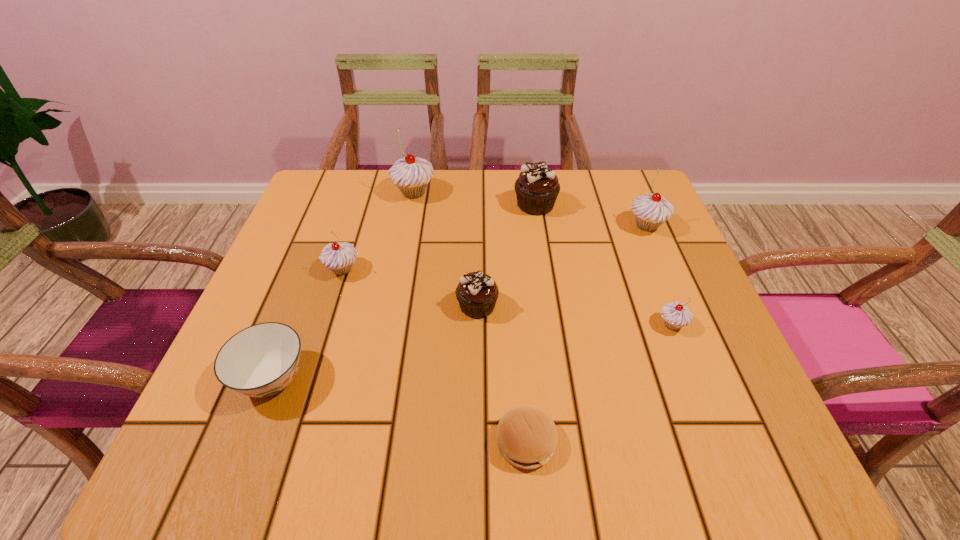
Find the location of a particular element. free spot at the near left corner of the desktop is located at coordinates (179, 458).

This screenshot has height=540, width=960. In the image, there is a desktop. What are the coordinates of `vacant area at the far right corner` in the screenshot? It's located at (614, 177).

I want to click on vacant space at the near right corner, so click(x=740, y=454).

The width and height of the screenshot is (960, 540). I want to click on free space between the farthest gray cupcake and the nearest gray cupcake, so click(x=542, y=259).

The width and height of the screenshot is (960, 540). What are the coordinates of `free area in between the nearest gray cupcake and the second gray cupcake from left to right` in the screenshot? It's located at (542, 259).

This screenshot has width=960, height=540. What are the coordinates of `unoccupied area between the nearest gray cupcake and the seventh tallest object` in the screenshot? It's located at (472, 352).

The height and width of the screenshot is (540, 960). In order to click on free spot between the nearest gray cupcake and the farther brown cupcake in this screenshot , I will do `click(604, 265)`.

This screenshot has height=540, width=960. In order to click on vacant space in between the leftmost cupcake and the farther brown cupcake in this screenshot , I will do `click(439, 237)`.

The width and height of the screenshot is (960, 540). Find the location of `free spot between the fourth farthest object and the patty`. free spot between the fourth farthest object and the patty is located at coordinates (434, 356).

Find the location of a particular element. free spot between the tallest cupcake and the smallest gray cupcake is located at coordinates (542, 259).